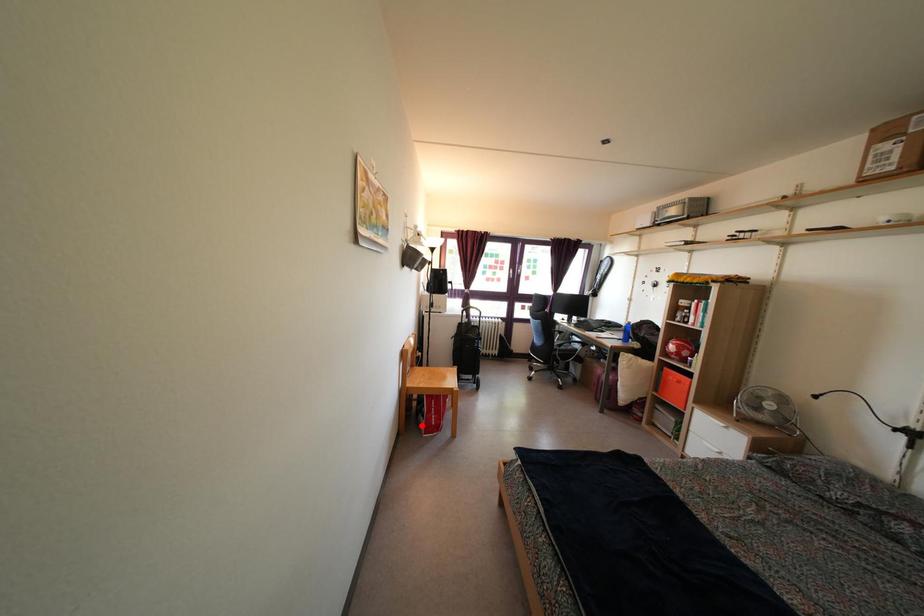
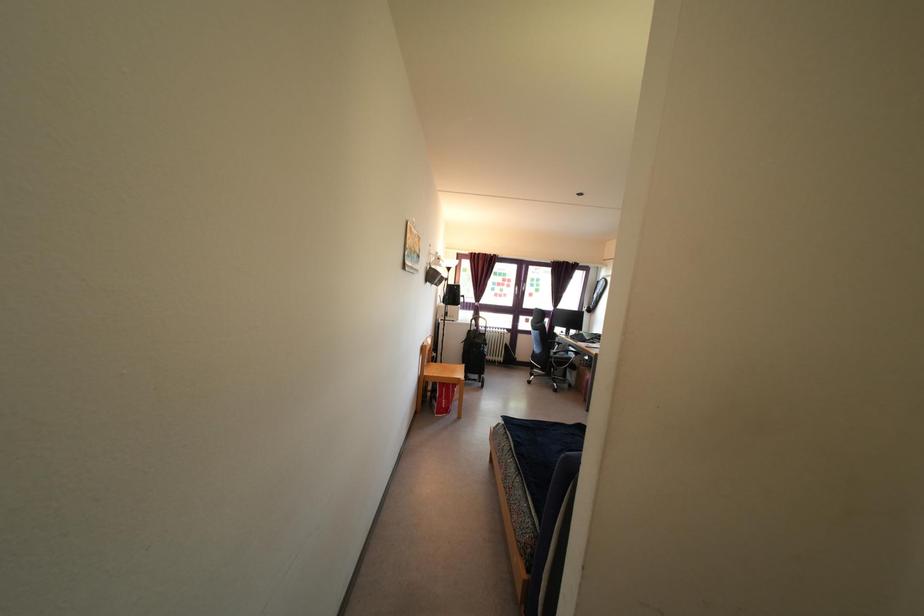
Locate, in the second image, the point that corresponds to the highlighted location in the first image.

(435, 408)